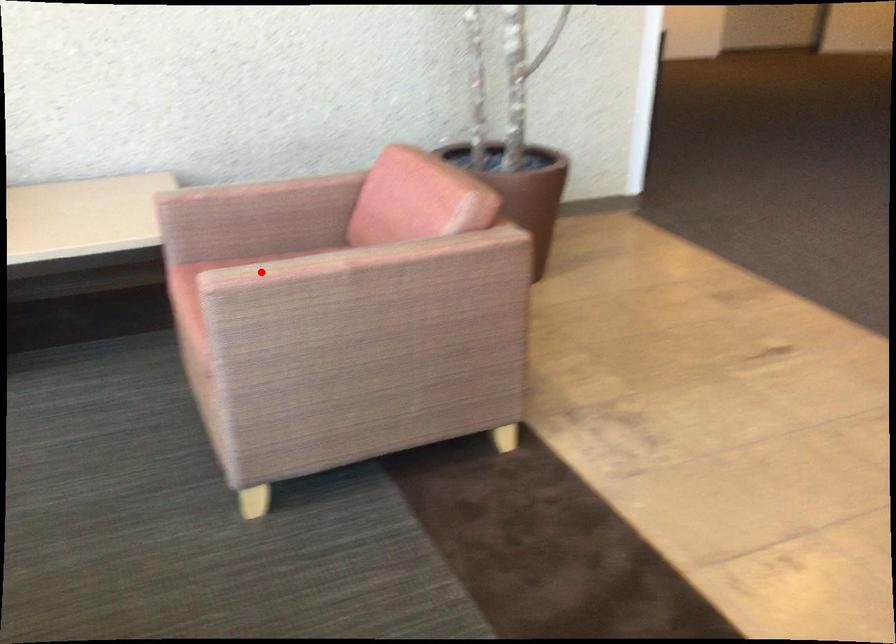
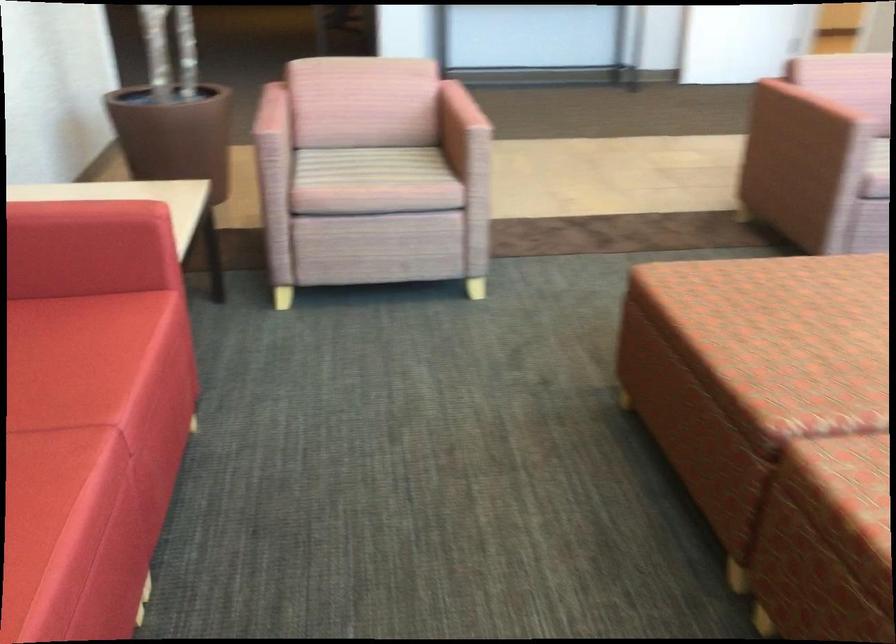
Question: I am providing you with two images of the same scene from different viewpoints. Given a red point in image1, look at the same physical point in image2. Is it:

Choices:
 (A) Closer to the viewpoint
 (B) Farther from the viewpoint

Answer: (B)